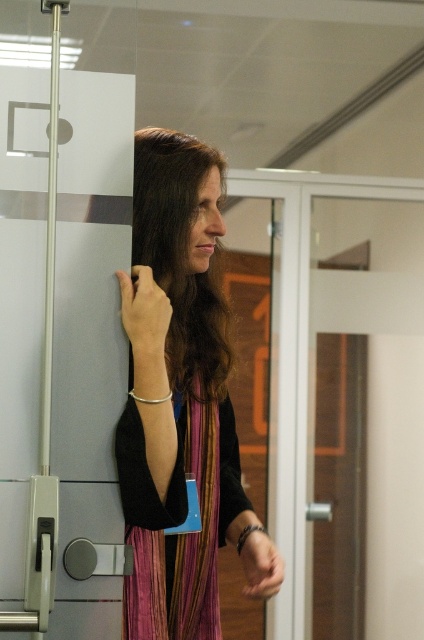
You are a photographer setting up for a portrait. You need to position your camera so that the multicolored striped dress at center and the smooth skin hand at upper left are both in focus. The camera has a depth of field that can cover 20 centimeters. Will both subjects be in focus?

The distance between the multicolored striped dress at center and the smooth skin hand at upper left is 19.23 centimeters, which is within the camera depth of field of 20 centimeters. Therefore, both subjects will be in focus.

You are a security guard in the building and need to verify the badge of the person standing by the transparent glass door at center and the matte black hand at lower center. Which object is bigger in size?

The transparent glass door at center has a larger size compared to the matte black hand at lower center.